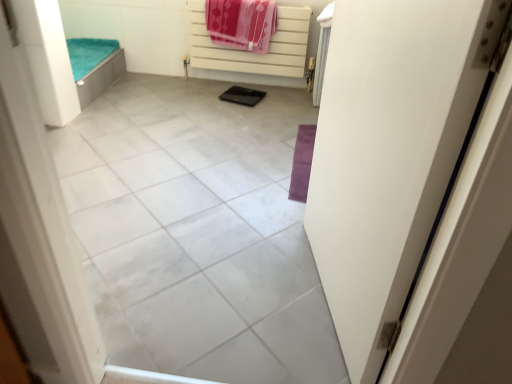
Locate an element on the screen. blank space to the left of white matte door at right is located at coordinates (221, 273).